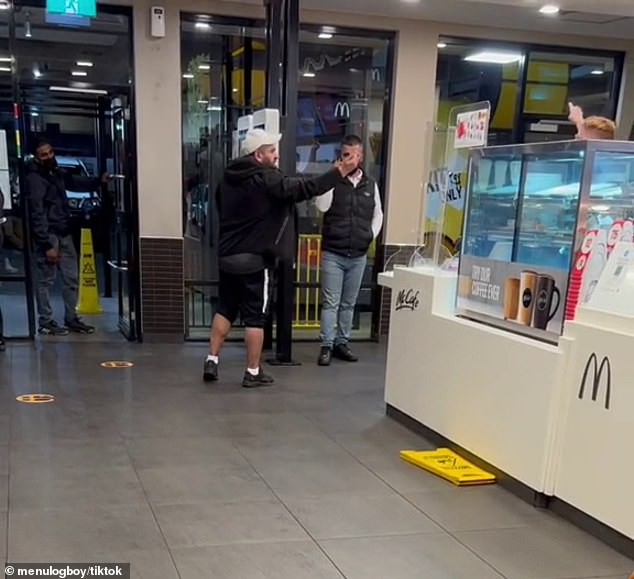
Where is `columns`? This screenshot has width=634, height=579. columns is located at coordinates (149, 67), (425, 73).